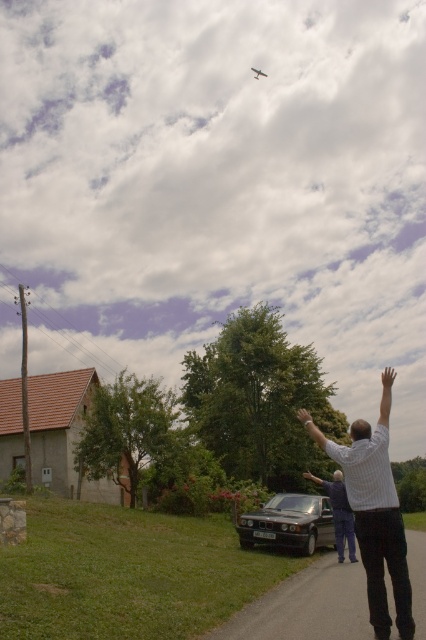
You are standing at the entrance of the house and looking towards the paved path. Which direction should you walk to reach the white striped shirt at center?

Since the white striped shirt at center is located at point (374, 513), you should walk towards the right side of the paved path to reach it.

Consider the image. You are a photographer trying to capture the man in the white striped shirt at center and his smooth skin arm at center. Since you want to focus on the shirt, which object should you ensure is not blocking the view of the shirt?

The white striped shirt at center is in front of the smooth skin arm at center, so the smooth skin arm at center is behind the shirt and not blocking its view. Therefore, there is no need to adjust for blocking in this case.

You are a photographer trying to capture the scene. The smooth skin arm at center and the metallic silver airplane at upper center are both in your viewfinder. Which object appears larger in the photo?

The smooth skin arm at center appears larger in the photo because it is bigger than the metallic silver airplane at upper center.